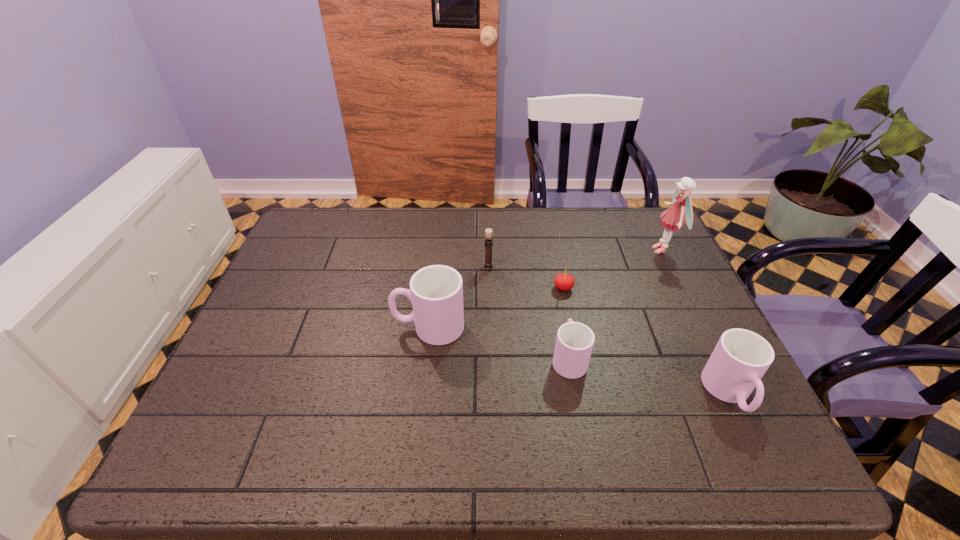
Where is `vacant space located 0.240m with the handle on the side of the shortest cup`? The height and width of the screenshot is (540, 960). vacant space located 0.240m with the handle on the side of the shortest cup is located at coordinates (553, 274).

At what (x,y) coordinates should I click in order to perform the action: click on vacant space located with the handle on the side of the shortest cup. Please return your answer as a coordinate pair (x, y). Looking at the image, I should click on [553, 272].

At what (x,y) coordinates should I click in order to perform the action: click on free space located 0.110m with the handle on the side of the shortest cup. Please return your answer as a coordinate pair (x, y). The image size is (960, 540). Looking at the image, I should click on (559, 307).

At what (x,y) coordinates should I click in order to perform the action: click on free space located 0.200m on the back of the candle holder. Please return your answer as a coordinate pair (x, y). Looking at the image, I should click on (488, 224).

Locate an element on the screen. This screenshot has height=540, width=960. vacant space situated 0.160m on the front-facing side of the doll is located at coordinates (598, 250).

Where is `vacant space located on the front-facing side of the doll`? The width and height of the screenshot is (960, 540). vacant space located on the front-facing side of the doll is located at coordinates (588, 250).

The image size is (960, 540). Identify the location of vacant point located 0.130m on the front-facing side of the doll. (609, 250).

You are a GUI agent. You are given a task and a screenshot of the screen. Output one action in this format:
    pyautogui.click(x=<x>, y=<y>)
    Task: Click on the vacant space positioned 0.120m on the back of the cherry
    
    Given the screenshot: What is the action you would take?
    pyautogui.click(x=557, y=255)

You are a GUI agent. You are given a task and a screenshot of the screen. Output one action in this format:
    pyautogui.click(x=<x>, y=<y>)
    Task: Click on the object that is at the far edge
    This screenshot has height=540, width=960.
    Given the screenshot: What is the action you would take?
    pyautogui.click(x=673, y=218)

Find the location of `object located in the near edge section of the desktop`. object located in the near edge section of the desktop is located at coordinates (741, 357).